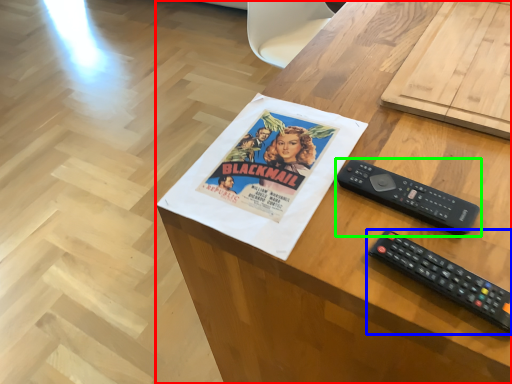
Question: Considering the real-world distances, which object is closest to desk (highlighted by a red box)? remote control (highlighted by a blue box) or remote control (highlighted by a green box).

Choices:
 (A) remote control
 (B) remote control

Answer: (B)